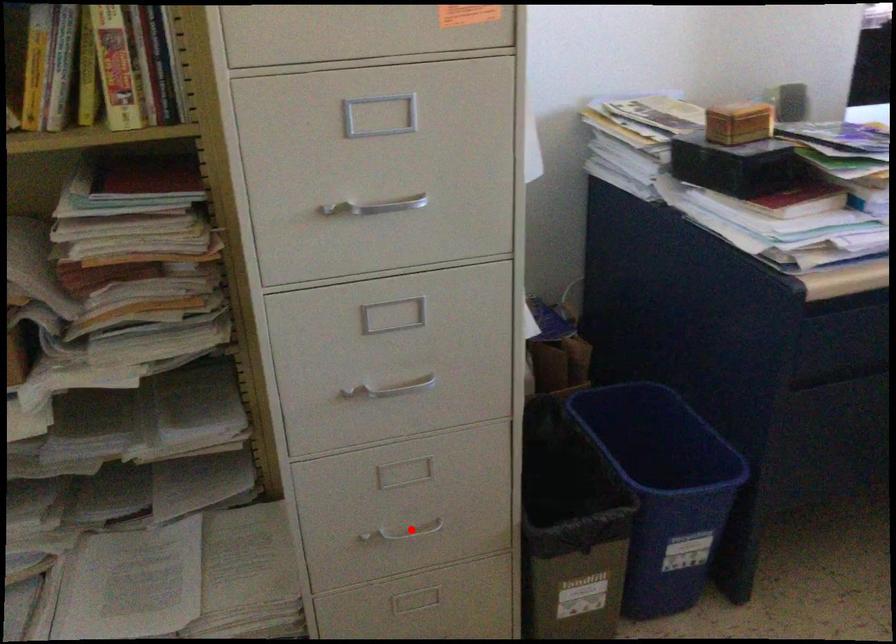
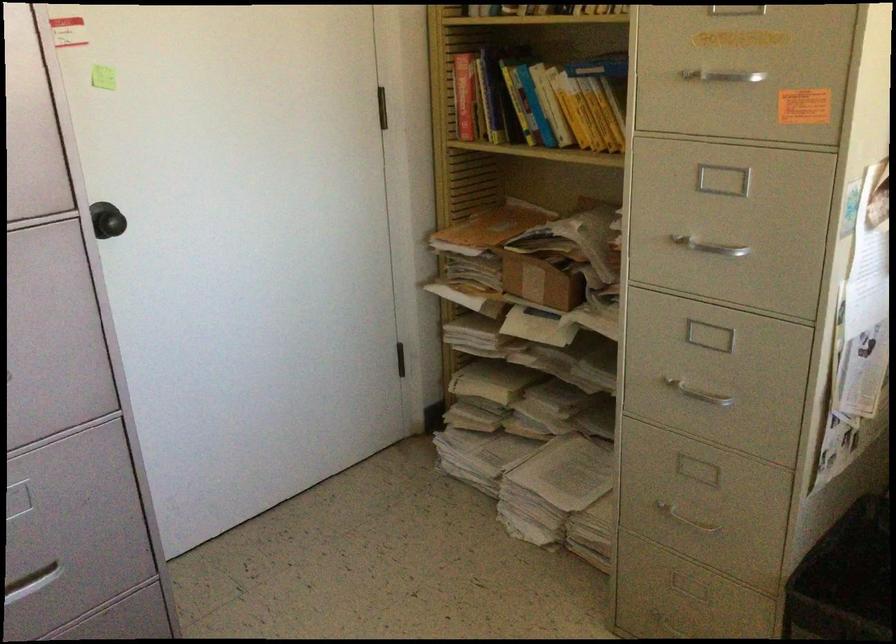
Question: I am providing you with two images of the same scene from different viewpoints. In image1, a red point is highlighted. Considering the same 3D point in image2, which of the following is correct?

Choices:
 (A) It is closer
 (B) It is farther

Answer: (B)